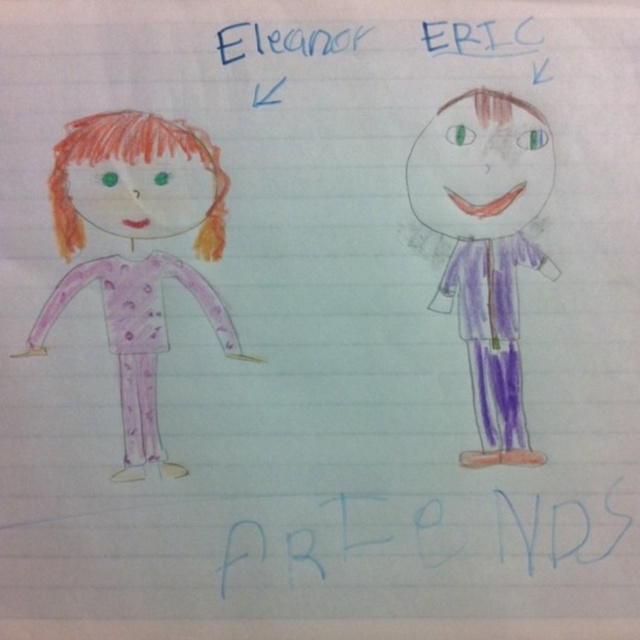
Question: Is matte pink pajamas at left to the left of blue paper at center from the viewer's perspective?

Choices:
 (A) no
 (B) yes

Answer: (B)

Question: Does matte pink pajamas at left come in front of purple paper doll at right?

Choices:
 (A) yes
 (B) no

Answer: (B)

Question: Can you confirm if blue paper at center is positioned below purple paper doll at right?

Choices:
 (A) no
 (B) yes

Answer: (B)

Question: Which point appears farthest from the camera in this image?

Choices:
 (A) (422, 520)
 (B) (477, 426)
 (C) (209, 221)

Answer: (B)

Question: Which point is farther to the camera?

Choices:
 (A) purple paper doll at right
 (B) blue paper at center
 (C) matte pink pajamas at left

Answer: (B)

Question: Which point is farther from the camera taking this photo?

Choices:
 (A) (461, 330)
 (B) (150, 310)

Answer: (B)